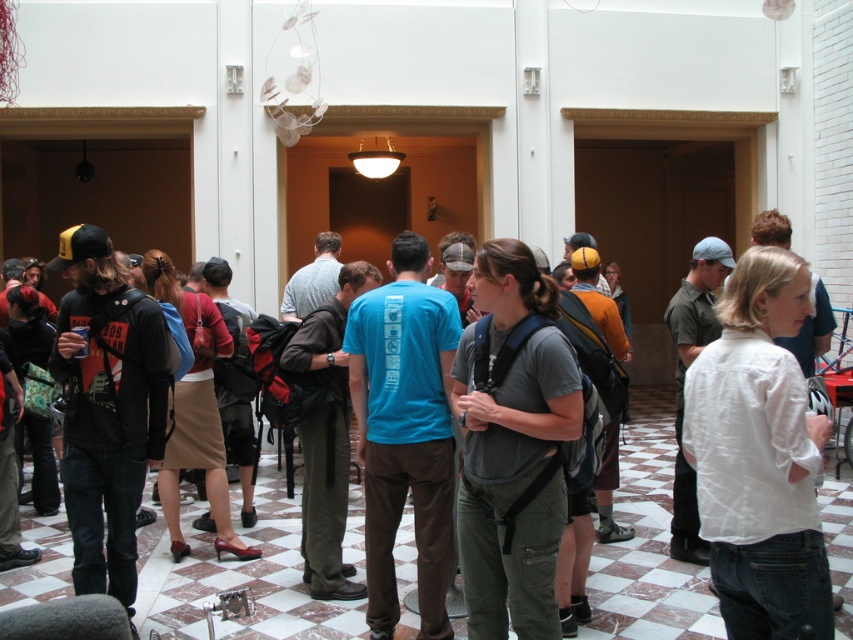
Question: Where is blue t-shirt at center located in relation to brown suede skirt at center in the image?

Choices:
 (A) below
 (B) above

Answer: (A)

Question: Is black cotton hoodie at left further to camera compared to brown suede skirt at center?

Choices:
 (A) yes
 (B) no

Answer: (B)

Question: Which point is farther to the camera?

Choices:
 (A) (234, 369)
 (B) (154, 454)

Answer: (A)

Question: Which of the following is the closest to the observer?

Choices:
 (A) (344, 472)
 (B) (198, 310)

Answer: (A)

Question: Can you confirm if gray fabric backpack at center is positioned above brown fabric skirt at center?

Choices:
 (A) yes
 (B) no

Answer: (B)

Question: Which object appears closest to the camera in this image?

Choices:
 (A) white cotton shirt at center
 (B) blue t-shirt at center
 (C) black cotton hoodie at left
 (D) brown fabric skirt at center

Answer: (A)